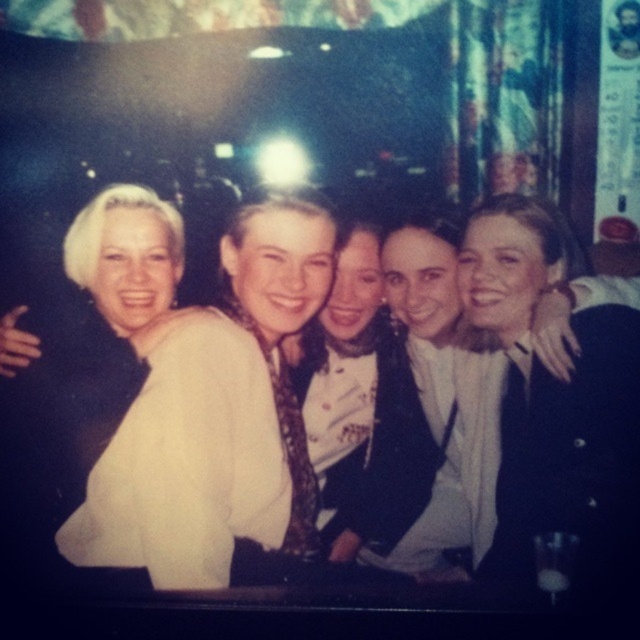
Who is lower down, white satin blouse at center or black satin jacket at center?

white satin blouse at center is lower down.

Where is `white satin blouse at center`? Image resolution: width=640 pixels, height=640 pixels. white satin blouse at center is located at coordinates (216, 413).

In order to click on white satin blouse at center in this screenshot , I will do `click(216, 413)`.

Is white satin blouse at center below blonde hair at left?

Correct, white satin blouse at center is located below blonde hair at left.

Does white satin blouse at center appear on the left side of blonde hair at left?

Incorrect, white satin blouse at center is not on the left side of blonde hair at left.

Where is `white satin blouse at center`? The width and height of the screenshot is (640, 640). white satin blouse at center is located at coordinates (216, 413).

Locate an element on the screen. This screenshot has width=640, height=640. white satin blouse at center is located at coordinates (216, 413).

Does black satin jacket at center have a greater height compared to blonde hair at left?

Yes, black satin jacket at center is taller than blonde hair at left.

Is black satin jacket at center thinner than blonde hair at left?

Yes, black satin jacket at center is thinner than blonde hair at left.

Where is `black satin jacket at center`? This screenshot has height=640, width=640. black satin jacket at center is located at coordinates coord(554,406).

You are a GUI agent. You are given a task and a screenshot of the screen. Output one action in this format:
    pyautogui.click(x=<x>, y=<y>)
    Task: Click on the black satin jacket at center
    This screenshot has height=640, width=640.
    Given the screenshot: What is the action you would take?
    pyautogui.click(x=554, y=406)